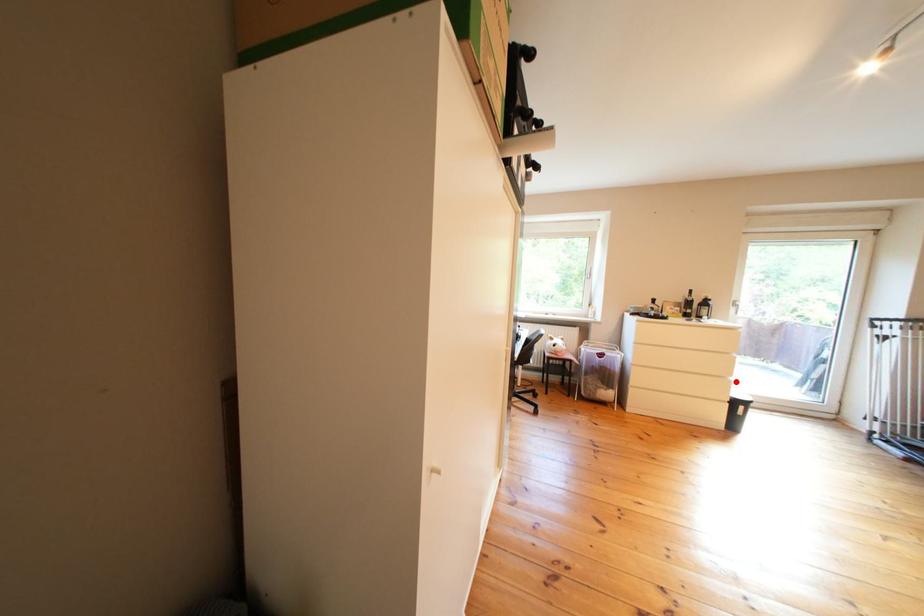
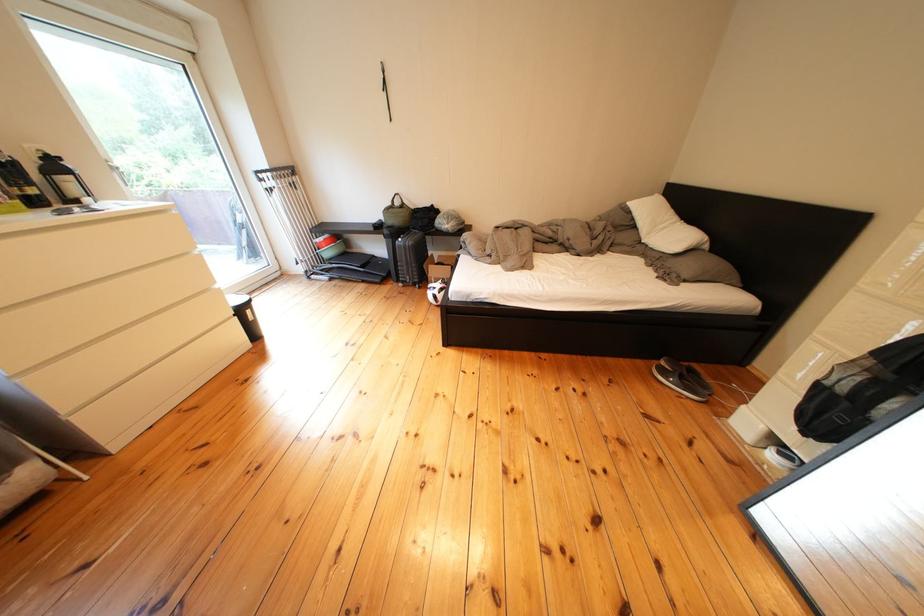
In the second image, find the point that corresponds to the highlighted location in the first image.

(220, 294)